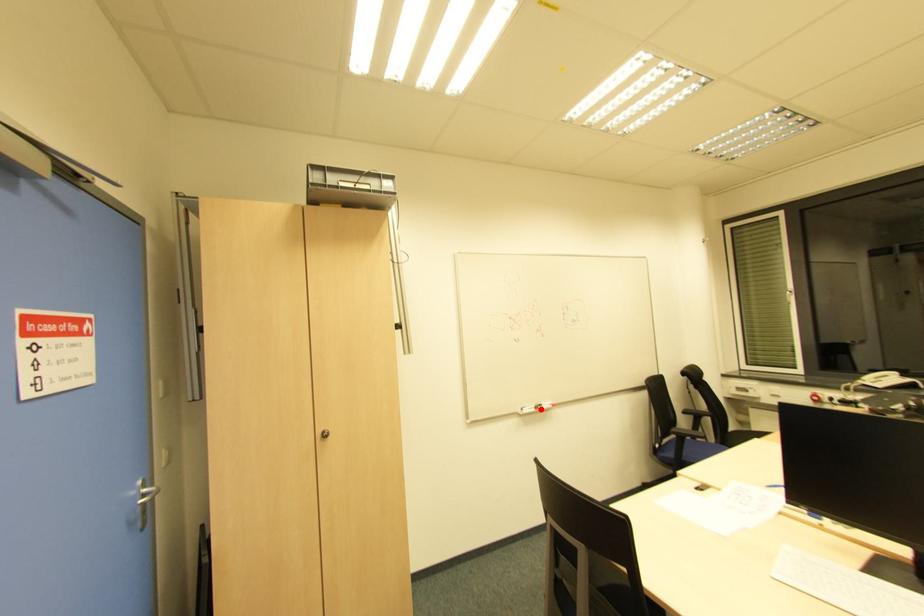
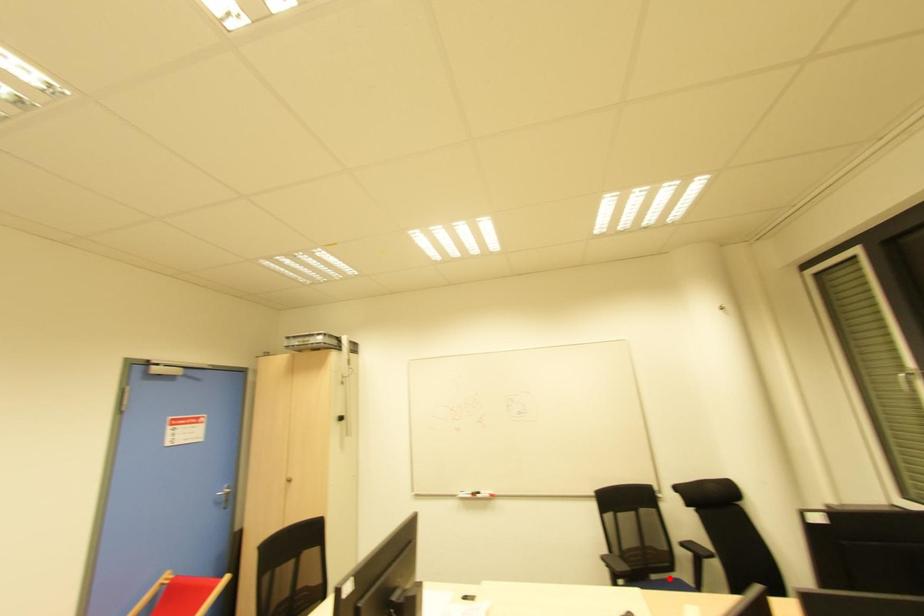
I am providing you with two images of the same scene from different viewpoints. A red point is marked on the first image and another point is marked on the second image. Do the highlighted points in image1 and image2 indicate the same real-world spot?

No